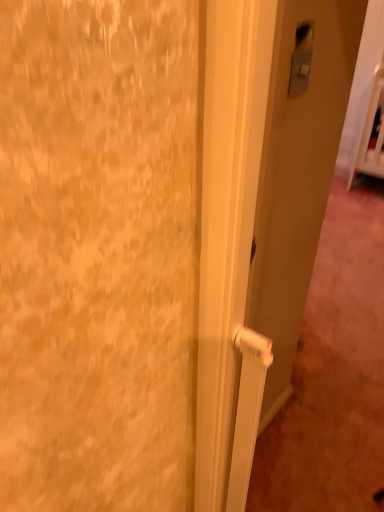
Question: Is white plastic door handle at center not within satin silver switch at upper right?

Choices:
 (A) no
 (B) yes

Answer: (B)

Question: Is white plastic door handle at center with satin silver switch at upper right?

Choices:
 (A) yes
 (B) no

Answer: (B)

Question: Does white plastic door handle at center have a greater width compared to satin silver switch at upper right?

Choices:
 (A) yes
 (B) no

Answer: (A)

Question: Considering the relative sizes of white plastic door handle at center and satin silver switch at upper right in the image provided, is white plastic door handle at center shorter than satin silver switch at upper right?

Choices:
 (A) no
 (B) yes

Answer: (A)

Question: Is satin silver switch at upper right at the back of white plastic door handle at center?

Choices:
 (A) no
 (B) yes

Answer: (B)

Question: Could satin silver switch at upper right be considered to be inside white plastic door handle at center?

Choices:
 (A) yes
 (B) no

Answer: (A)

Question: Considering the relative positions of satin silver switch at upper right and white plastic door handle at center in the image provided, is satin silver switch at upper right to the right of white plastic door handle at center from the viewer's perspective?

Choices:
 (A) no
 (B) yes

Answer: (A)

Question: Is satin silver switch at upper right wider than white plastic door handle at center?

Choices:
 (A) no
 (B) yes

Answer: (A)

Question: Does satin silver switch at upper right have a greater height compared to white plastic door handle at center?

Choices:
 (A) yes
 (B) no

Answer: (B)

Question: Is white plastic door handle at center located within satin silver switch at upper right?

Choices:
 (A) yes
 (B) no

Answer: (B)

Question: Does satin silver switch at upper right have a larger size compared to white plastic door handle at center?

Choices:
 (A) yes
 (B) no

Answer: (B)

Question: Is satin silver switch at upper right facing away from white plastic door handle at center?

Choices:
 (A) no
 (B) yes

Answer: (B)

Question: From the image's perspective, is satin silver switch at upper right above or below white plastic door handle at center?

Choices:
 (A) below
 (B) above

Answer: (B)